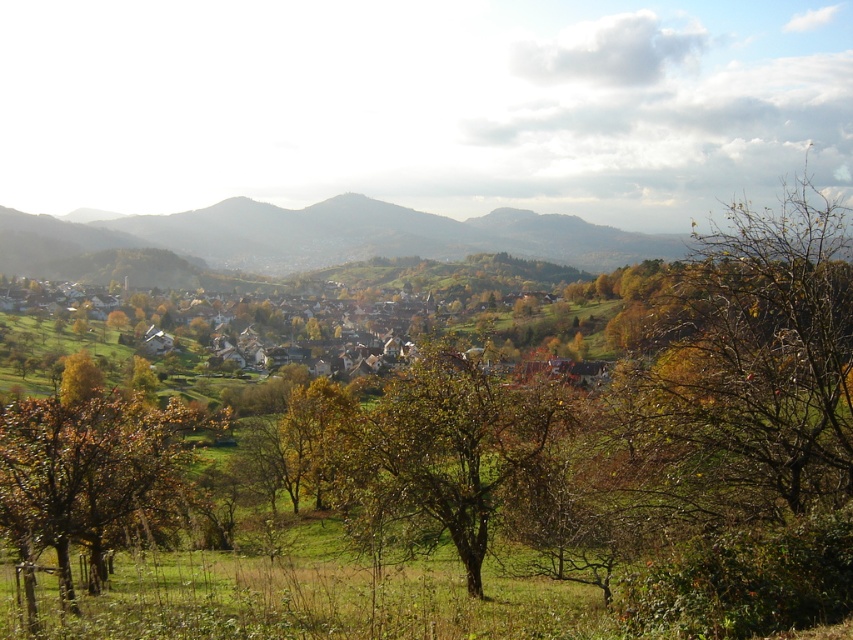
Is rugged brown mountain at center shorter than brown leafy tree at lower left?

No.

What do you see at coordinates (322, 236) in the screenshot? I see `rugged brown mountain at center` at bounding box center [322, 236].

Is point (496, 228) closer to camera compared to point (178, 419)?

No, (496, 228) is further to viewer.

Locate an element on the screen. Image resolution: width=853 pixels, height=640 pixels. rugged brown mountain at center is located at coordinates (322, 236).

Between brown leafless tree at right and green leafy tree at center, which one is positioned lower?

green leafy tree at center is below.

Is point (828, 420) farther from camera compared to point (540, 412)?

That is False.

Identify the location of brown leafless tree at right. (747, 369).

In the scene shown: Does brown leafless tree at right appear under brown leafy tree at lower left?

No, brown leafless tree at right is not below brown leafy tree at lower left.

Who is taller, brown leafless tree at right or brown leafy tree at lower left?

brown leafless tree at right

Find the location of a particular element. brown leafless tree at right is located at coordinates (747, 369).